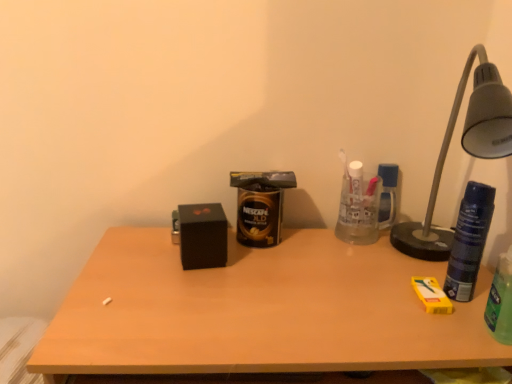
The width and height of the screenshot is (512, 384). In order to click on vacant location below metallic gray lamp at right (from a real-world perspective) in this screenshot , I will do `click(440, 277)`.